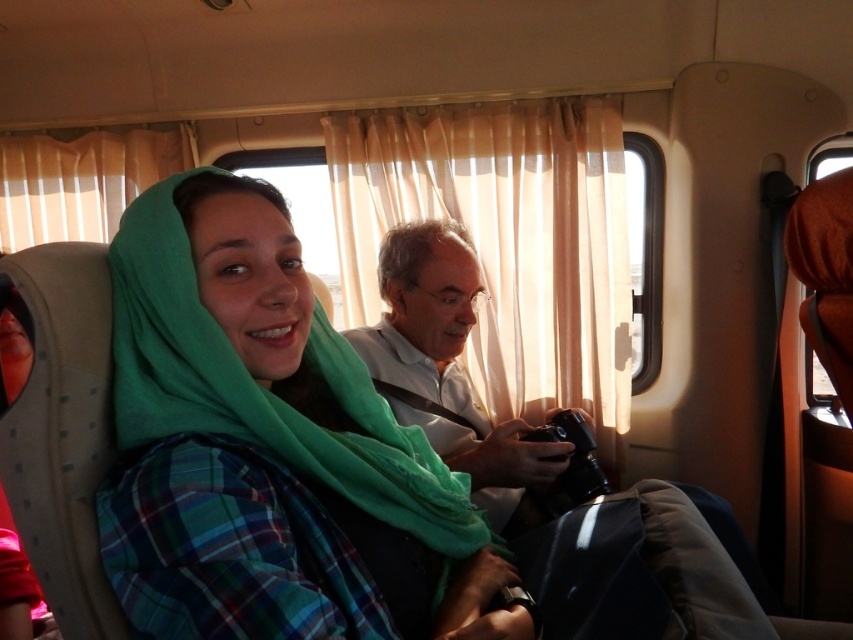
You are a photographer trying to capture a detailed image of the green fabric shawl at center and the matte black camera at center. Since you want to ensure both objects are in focus, you need to know which object is wider. Which one is wider?

The matte black camera at center is wider than the green fabric shawl at center.

In the scene shown: You are standing inside a bus and want to take a photo of the woman in the green headscarf and plaid shirt. The camera you have is at point (309, 563). Can you reach the camera to take the photo if you need to be within 30 inches of it?

The distance between you and the camera at point (309, 563) is 29.72 inches, which is within the required 30 inches. Yes, you can reach the camera to take the photo.

You are a passenger on a bus and want to find the green fabric shawl at center. Which object in the scene corresponds to the coordinates point (265,445)?

The green fabric shawl at center is represented by point (265,445).